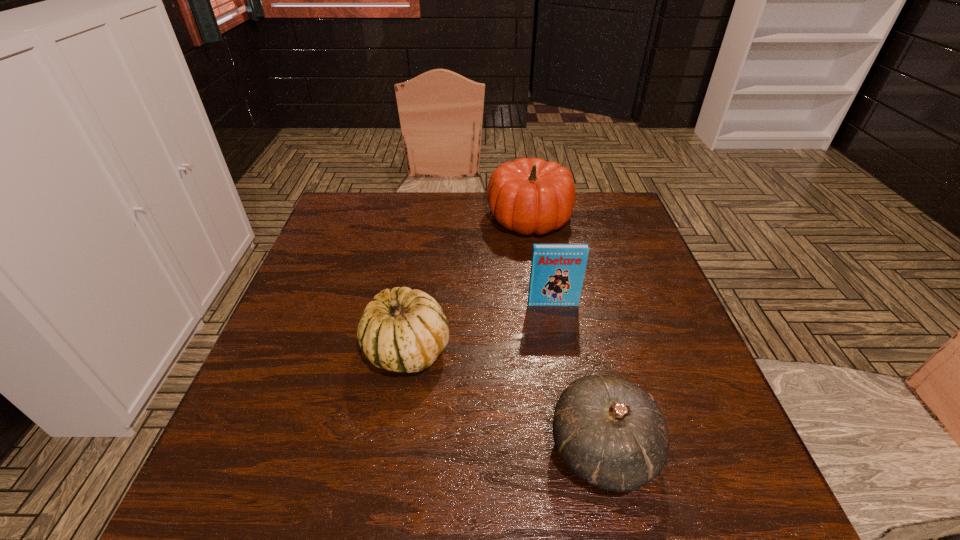
Point out which object is positioned as the third nearest to the nearest object. Please provide its 2D coordinates. Your answer should be formatted as a tuple, i.e. [(x, y)], where the tuple contains the x and y coordinates of a point satisfying the conditions above.

[(528, 196)]

What are the coordinates of `vacant area in the image that satisfies the following two spatial constraints: 1. on the front cover of the right gourd; 2. on the left side of the third nearest object` in the screenshot? It's located at (579, 449).

Where is `free space that satisfies the following two spatial constraints: 1. on the front cover of the second farthest object; 2. on the left side of the nearest object`? The height and width of the screenshot is (540, 960). free space that satisfies the following two spatial constraints: 1. on the front cover of the second farthest object; 2. on the left side of the nearest object is located at coordinates (x=579, y=449).

The height and width of the screenshot is (540, 960). I want to click on vacant point that satisfies the following two spatial constraints: 1. on the front cover of the nearer gourd; 2. on the right side of the second farthest object, so [x=579, y=449].

The height and width of the screenshot is (540, 960). Identify the location of free space that satisfies the following two spatial constraints: 1. on the back side of the leftmost object; 2. on the left side of the farthest object. (428, 218).

What are the coordinates of `free space in the image that satisfies the following two spatial constraints: 1. on the front cover of the right gourd; 2. on the right side of the second farthest object` in the screenshot? It's located at (579, 449).